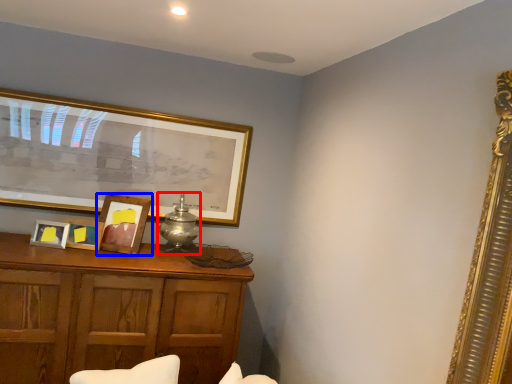
Question: Which of the following is the closest to the observer, table lamp (highlighted by a red box) or picture frame (highlighted by a blue box)?

Choices:
 (A) table lamp
 (B) picture frame

Answer: (B)